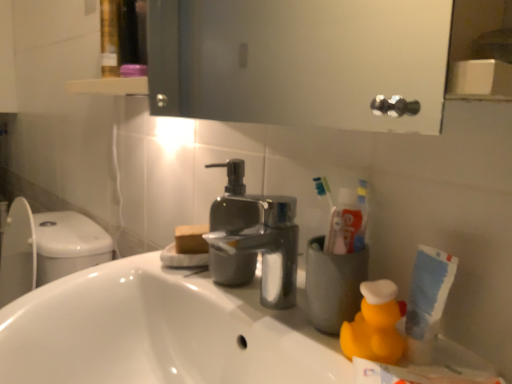
Question: Considering the positions of polished metallic faucet at center and yellow rubber duck at lower right in the image, is polished metallic faucet at center bigger or smaller than yellow rubber duck at lower right?

Choices:
 (A) small
 (B) big

Answer: (B)

Question: Is polished metallic faucet at center taller or shorter than yellow rubber duck at lower right?

Choices:
 (A) tall
 (B) short

Answer: (A)

Question: Considering the real-world distances, which object is closest to the polished metallic faucet at center?

Choices:
 (A) white glossy sink at lower left
 (B) yellow rubber duck at lower right

Answer: (A)

Question: Which object is positioned closest to the white glossy sink at lower left?

Choices:
 (A) polished metallic faucet at center
 (B) yellow rubber duck at lower right

Answer: (A)